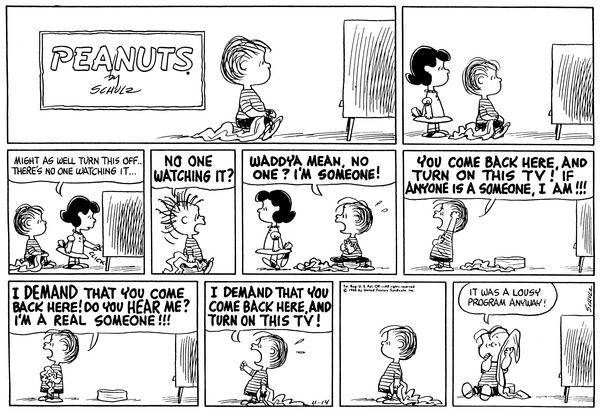
Image resolution: width=600 pixels, height=411 pixels. What are the coordinates of `tv` in the screenshot? It's located at (107, 228), (182, 365), (579, 350), (584, 237), (573, 99), (381, 100).